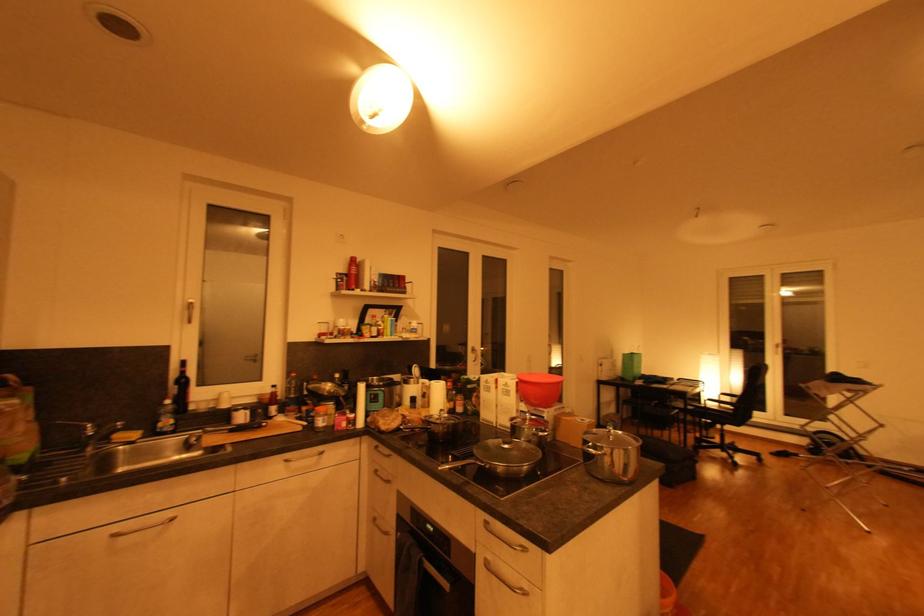
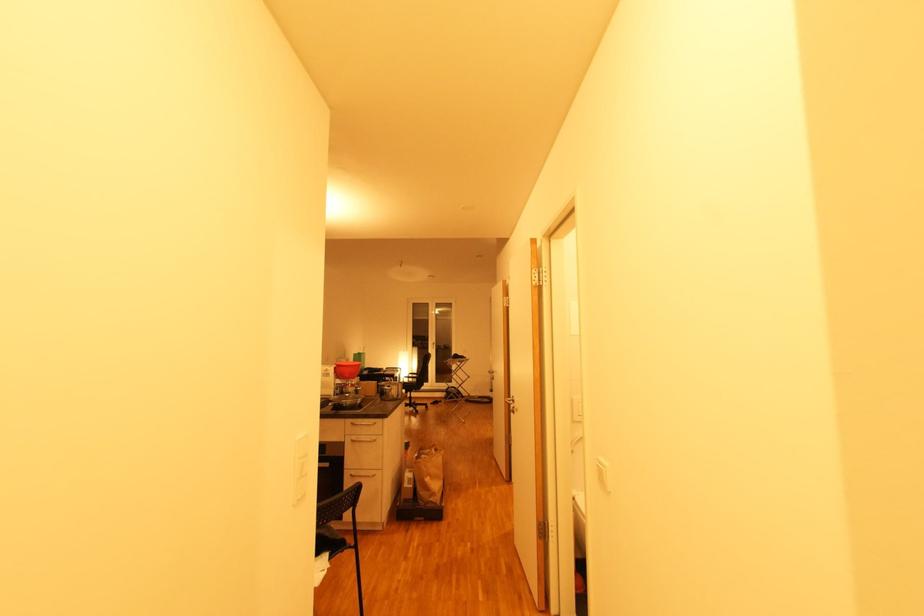
In the second image, find the point that corresponds to point (521, 384) in the first image.

(339, 369)